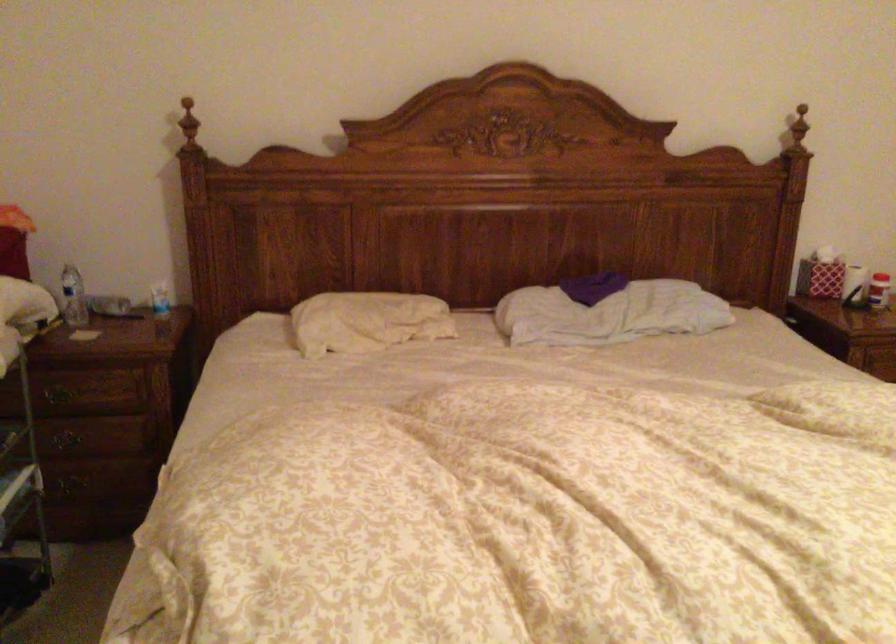
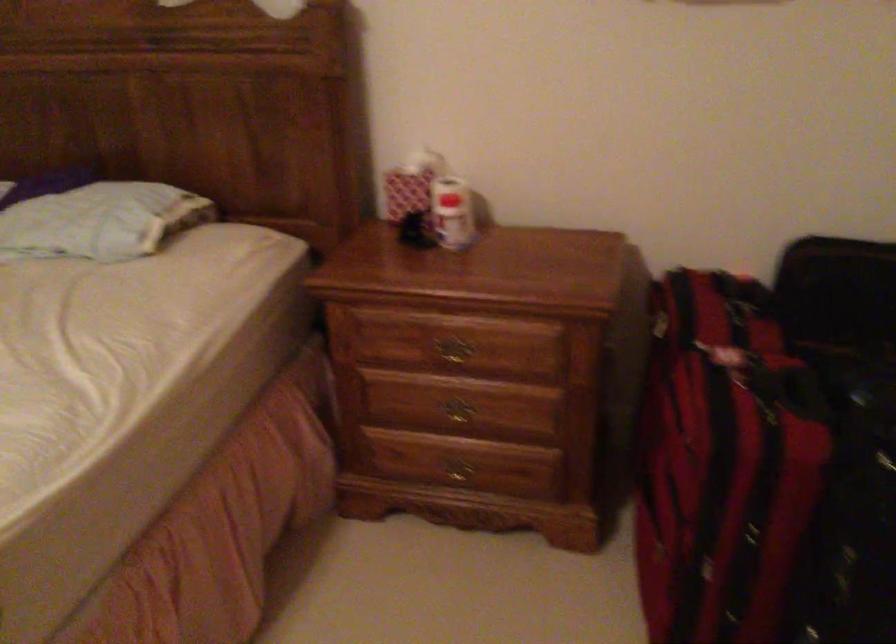
What movement of the cameraman would produce the second image?

→ The movement direction of the cameraman is right, forward.